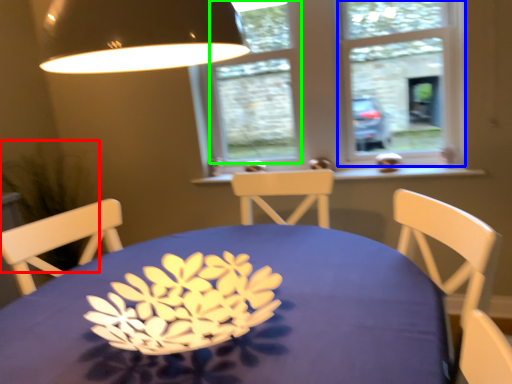
Question: Considering the real-world distances, which object is closest to plant (highlighted by a red box)? window frame (highlighted by a blue box) or window (highlighted by a green box).

Choices:
 (A) window frame
 (B) window

Answer: (B)